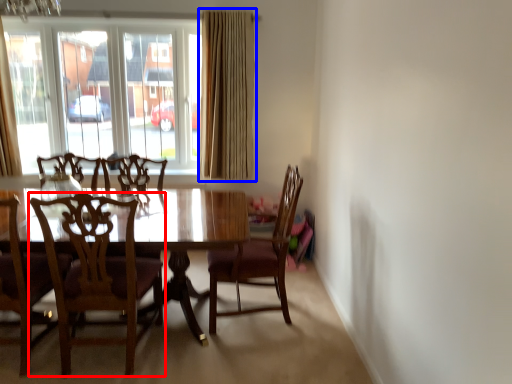
Question: Which object appears closest to the camera in this image, chair (highlighted by a red box) or curtain (highlighted by a blue box)?

Choices:
 (A) chair
 (B) curtain

Answer: (A)